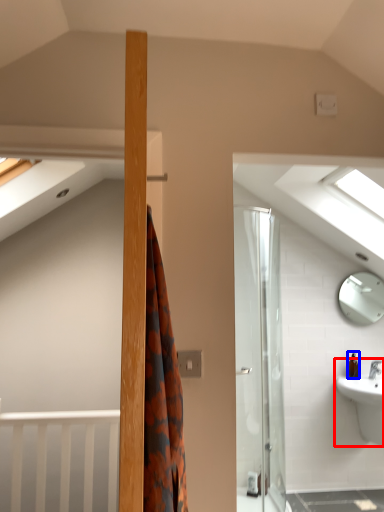
Question: Which object appears closest to the camera in this image, sink (highlighted by a red box) or toiletry (highlighted by a blue box)?

Choices:
 (A) sink
 (B) toiletry

Answer: (A)